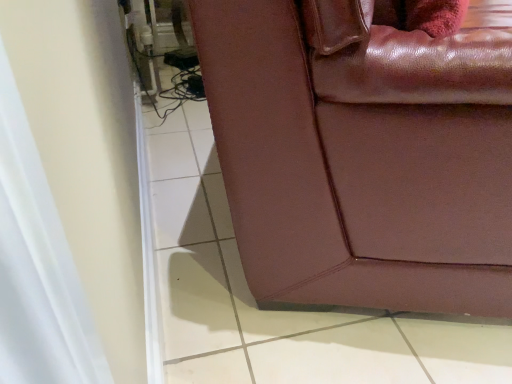
The height and width of the screenshot is (384, 512). Describe the element at coordinates (362, 155) in the screenshot. I see `leather couch at lower right` at that location.

The height and width of the screenshot is (384, 512). What are the coordinates of `leather couch at lower right` in the screenshot? It's located at (362, 155).

You are a GUI agent. You are given a task and a screenshot of the screen. Output one action in this format:
    pyautogui.click(x=<x>, y=<y>)
    Task: Click on the leather couch at lower right
    The image size is (512, 384).
    Given the screenshot: What is the action you would take?
    pyautogui.click(x=362, y=155)